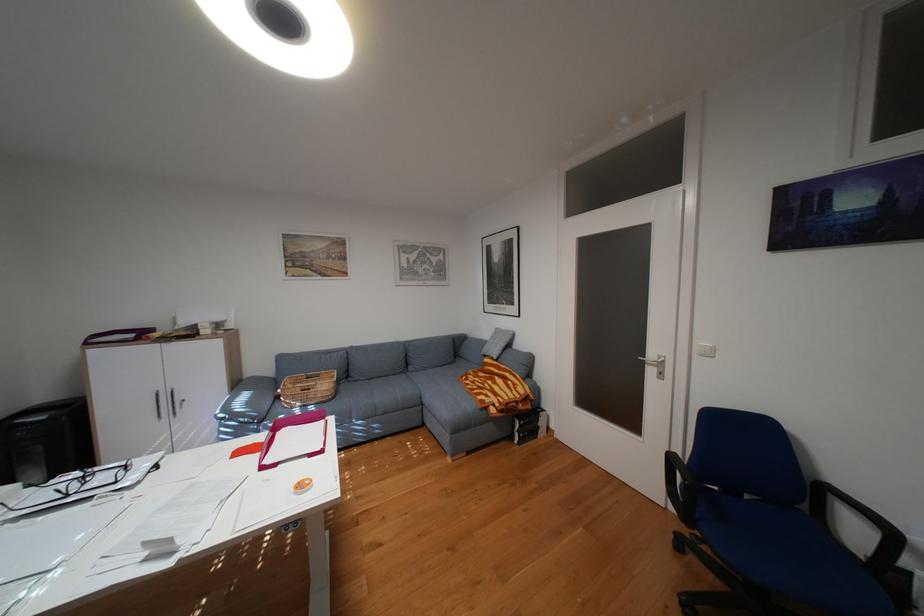
Find the location of a particular element. silver door handle is located at coordinates (653, 360).